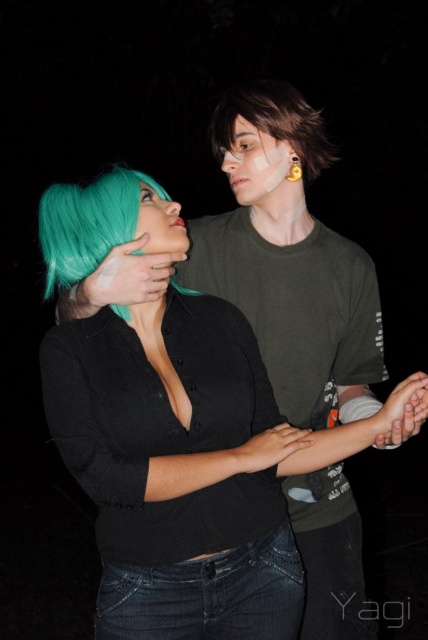
Does brown matte hair at upper center have a lesser height compared to matte black face at upper center?

No, brown matte hair at upper center is not shorter than matte black face at upper center.

Is brown matte hair at upper center to the left of matte black face at upper center from the viewer's perspective?

No, brown matte hair at upper center is not to the left of matte black face at upper center.

Is point (237, 90) closer to camera compared to point (234, 120)?

That is False.

Locate an element on the screen. This screenshot has width=428, height=640. brown matte hair at upper center is located at coordinates (273, 122).

Can you confirm if matte black shirt at center is thinner than teal matte wig at center?

Incorrect, matte black shirt at center's width is not less than teal matte wig at center's.

Can you confirm if matte black shirt at center is positioned to the left of teal matte wig at center?

In fact, matte black shirt at center is to the right of teal matte wig at center.

Is point (187, 579) in front of point (149, 193)?

Yes, it is in front of point (149, 193).

The height and width of the screenshot is (640, 428). Identify the location of matte black shirt at center. (190, 465).

Who is more distant from viewer, (270, 182) or (146, 250)?

The point (270, 182) is more distant.

Between point (287, 161) and point (151, 188), which one is positioned behind?

The point (287, 161) is more distant.

This screenshot has width=428, height=640. What are the coordinates of `matte black face at upper center` in the screenshot? It's located at (256, 164).